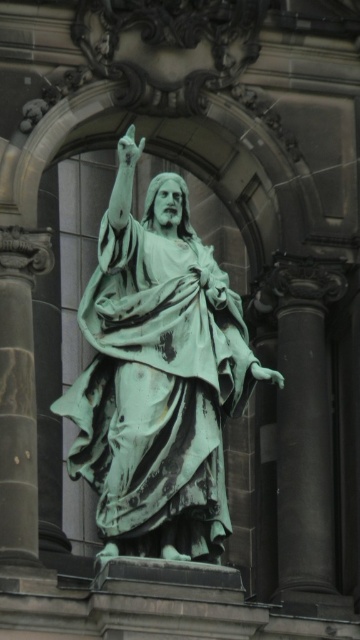
Can you confirm if green patina statue at center is positioned to the right of green patina stone pillar at left?

Yes, green patina statue at center is to the right of green patina stone pillar at left.

Between point (136, 348) and point (0, 516), which one is positioned in front?

Point (0, 516) is more forward.

Find the location of a particular element. green patina statue at center is located at coordinates (158, 376).

Does green marble pillar at right lie behind green patina stone pillar at left?

That is True.

In the scene shown: Which of these two, green marble pillar at right or green patina stone pillar at left, stands shorter?

Standing shorter between the two is green patina stone pillar at left.

Is point (316, 307) farther from camera compared to point (24, 288)?

Yes, it is behind point (24, 288).

Locate an element on the screen. This screenshot has width=360, height=640. green marble pillar at right is located at coordinates (303, 429).

Does green patina statue at center appear on the right side of green marble pillar at right?

Incorrect, green patina statue at center is not on the right side of green marble pillar at right.

Is green patina statue at center in front of green marble pillar at right?

That is True.

Is point (93, 328) farther from viewer compared to point (312, 392)?

No, it is not.

Locate an element on the screen. This screenshot has height=640, width=360. green patina statue at center is located at coordinates (158, 376).